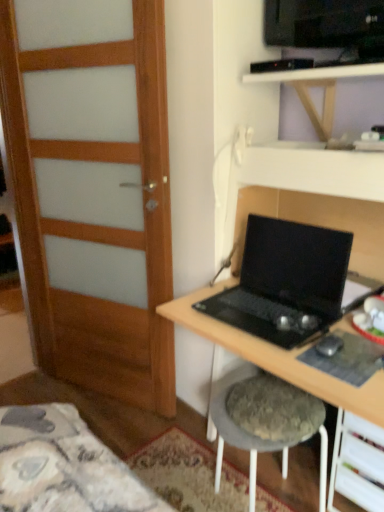
Question: Is wooden door at left outside wooden at upper center?

Choices:
 (A) no
 (B) yes

Answer: (B)

Question: Does wooden door at left have a greater width compared to wooden at upper center?

Choices:
 (A) yes
 (B) no

Answer: (B)

Question: Does wooden door at left turn towards wooden at upper center?

Choices:
 (A) yes
 (B) no

Answer: (B)

Question: Is wooden door at left facing away from wooden at upper center?

Choices:
 (A) no
 (B) yes

Answer: (A)

Question: From the image's perspective, is wooden door at left over wooden at upper center?

Choices:
 (A) no
 (B) yes

Answer: (A)

Question: From a real-world perspective, is wooden door at left physically below wooden at upper center?

Choices:
 (A) yes
 (B) no

Answer: (A)

Question: From a real-world perspective, does white plastic drawer at lower right stand above wooden at upper center?

Choices:
 (A) no
 (B) yes

Answer: (A)

Question: Considering the relative sizes of white plastic drawer at lower right and wooden at upper center in the image provided, is white plastic drawer at lower right bigger than wooden at upper center?

Choices:
 (A) yes
 (B) no

Answer: (B)

Question: Are white plastic drawer at lower right and wooden at upper center located far from each other?

Choices:
 (A) no
 (B) yes

Answer: (A)

Question: Does white plastic drawer at lower right have a greater height compared to wooden at upper center?

Choices:
 (A) yes
 (B) no

Answer: (A)

Question: From the image's perspective, is white plastic drawer at lower right located beneath wooden at upper center?

Choices:
 (A) no
 (B) yes

Answer: (B)

Question: Does white plastic drawer at lower right have a smaller size compared to wooden at upper center?

Choices:
 (A) no
 (B) yes

Answer: (B)

Question: Would you consider fuzzy fabric stool at lower center to be distant from black matte desk at center?

Choices:
 (A) yes
 (B) no

Answer: (B)